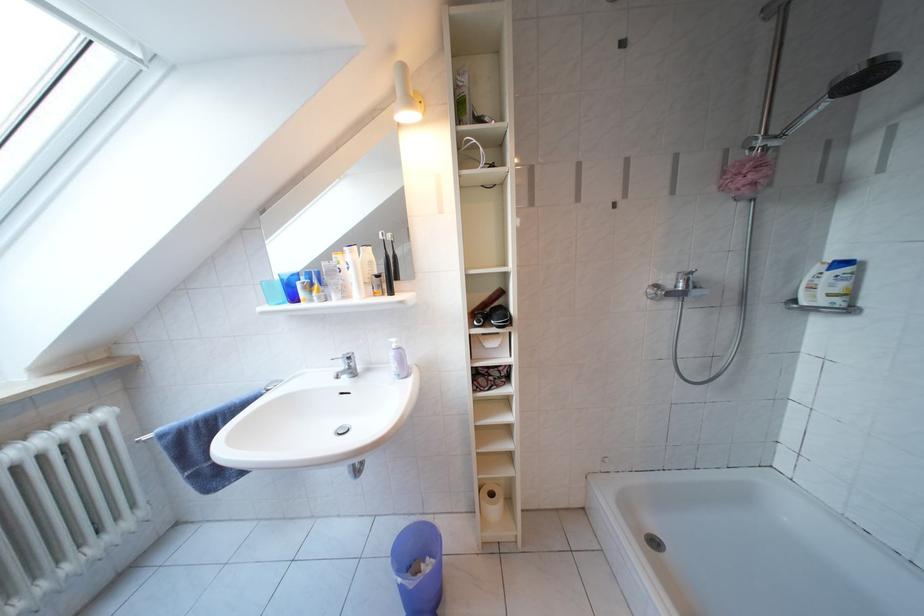
You are a GUI agent. You are given a task and a screenshot of the screen. Output one action in this format:
    pyautogui.click(x=<x>, y=<y>)
    Task: Click on the shampoo bottle
    The height and width of the screenshot is (616, 924).
    Given the screenshot: What is the action you would take?
    pyautogui.click(x=839, y=286)